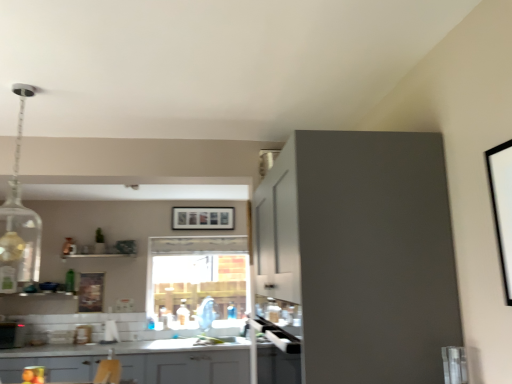
Question: Is green glass bottle at lower left wider than metallic silver toaster at lower left?

Choices:
 (A) yes
 (B) no

Answer: (B)

Question: Can you confirm if green glass bottle at lower left is bigger than metallic silver toaster at lower left?

Choices:
 (A) no
 (B) yes

Answer: (A)

Question: Considering the relative sizes of green glass bottle at lower left and metallic silver toaster at lower left in the image provided, is green glass bottle at lower left thinner than metallic silver toaster at lower left?

Choices:
 (A) yes
 (B) no

Answer: (A)

Question: From a real-world perspective, is green glass bottle at lower left under metallic silver toaster at lower left?

Choices:
 (A) no
 (B) yes

Answer: (A)

Question: Are green glass bottle at lower left and metallic silver toaster at lower left far apart?

Choices:
 (A) no
 (B) yes

Answer: (A)

Question: Is white glossy sink at center inside the boundaries of matte gray cabinet at upper right, the first cabinetry in the top-to-bottom sequence, or outside?

Choices:
 (A) inside
 (B) outside

Answer: (B)

Question: In terms of width, does white glossy sink at center look wider or thinner when compared to matte gray cabinet at upper right, acting as the second cabinetry starting from the back?

Choices:
 (A) thin
 (B) wide

Answer: (A)

Question: Considering the positions of white glossy sink at center and matte gray cabinet at upper right, which is the second cabinetry from bottom to top, in the image, is white glossy sink at center bigger or smaller than matte gray cabinet at upper right, which is the second cabinetry from bottom to top,?

Choices:
 (A) small
 (B) big

Answer: (A)

Question: From a real-world perspective, is white glossy sink at center positioned above or below matte gray cabinet at upper right, arranged as the second cabinetry when viewed from the left?

Choices:
 (A) above
 (B) below

Answer: (B)

Question: Considering the relative positions of matte gray cabinets at lower center, the second cabinetry from the right, and white matte picture frame at upper right, acting as the third picture frame starting from the bottom, in the image provided, is matte gray cabinets at lower center, the second cabinetry from the right, to the left or to the right of white matte picture frame at upper right, acting as the third picture frame starting from the bottom,?

Choices:
 (A) left
 (B) right

Answer: (A)

Question: Is point (178, 362) closer or farther from the camera than point (496, 200)?

Choices:
 (A) farther
 (B) closer

Answer: (A)

Question: Looking at their shapes, would you say matte gray cabinets at lower center, which ranks as the 2th cabinetry in top-to-bottom order, is wider or thinner than white matte picture frame at upper right, which ranks as the third picture frame in left-to-right order?

Choices:
 (A) thin
 (B) wide

Answer: (B)

Question: In terms of height, does matte gray cabinets at lower center, the second cabinetry from the right, look taller or shorter compared to white matte picture frame at upper right, placed as the third picture frame when sorted from back to front?

Choices:
 (A) tall
 (B) short

Answer: (A)

Question: Which is correct: white glossy sink at center is inside matte gray cabinets at lower center, positioned as the 1th cabinetry in back-to-front order, or outside of it?

Choices:
 (A) outside
 (B) inside

Answer: (B)

Question: Is white glossy sink at center to the left or to the right of matte gray cabinets at lower center, positioned as the 1th cabinetry in left-to-right order, in the image?

Choices:
 (A) right
 (B) left

Answer: (A)